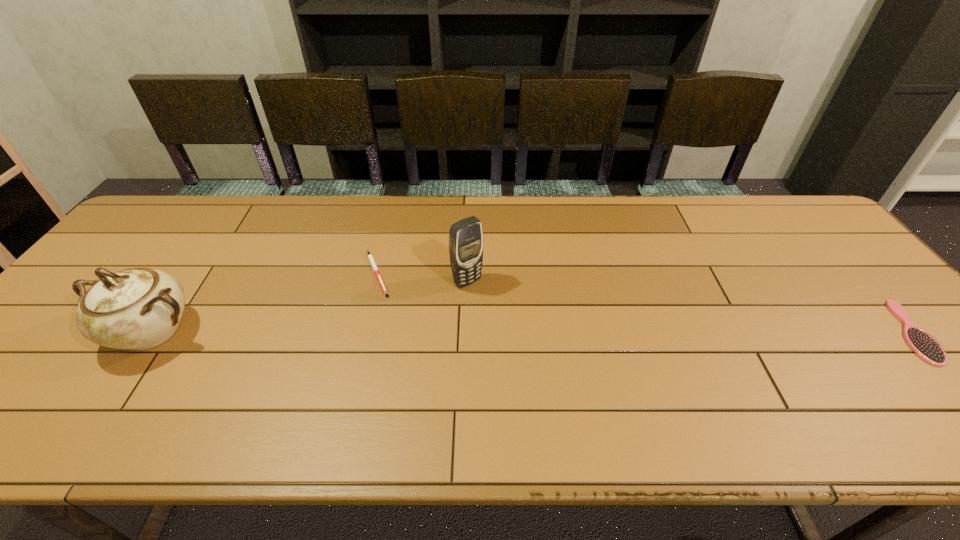
This screenshot has height=540, width=960. I want to click on free space on the desktop that is between the chinaware and the third tallest object and is positioned on the clicker of the second object from left to right, so click(x=489, y=332).

Locate an element on the screen. The height and width of the screenshot is (540, 960). vacant space on the desktop that is between the chinaware and the second shortest object and is positioned on the front face of the second object from right to left is located at coordinates [516, 332].